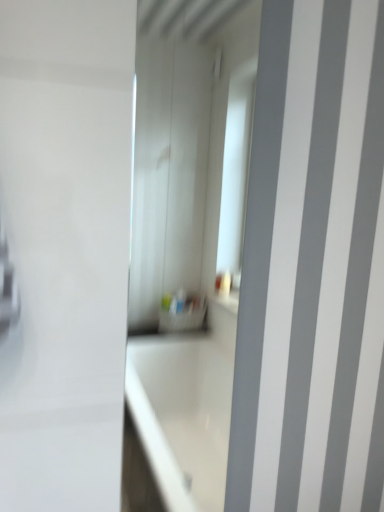
This screenshot has height=512, width=384. What do you see at coordinates (191, 157) in the screenshot?
I see `white glossy mirror at center` at bounding box center [191, 157].

Where is `white glossy mirror at center`? Image resolution: width=384 pixels, height=512 pixels. white glossy mirror at center is located at coordinates (191, 157).

Find the location of a particular element. The width and height of the screenshot is (384, 512). white glossy mirror at center is located at coordinates tap(191, 157).